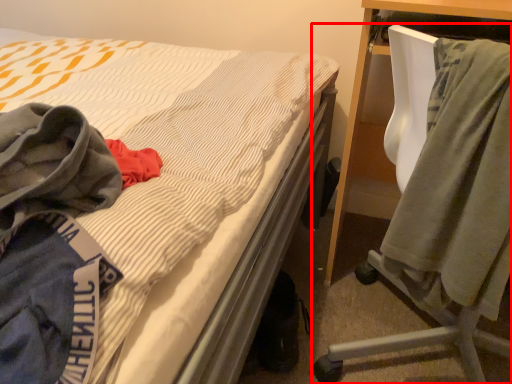
Question: From the image's perspective, where is chair (annotated by the red box) located in relation to cloak in the image?

Choices:
 (A) above
 (B) below

Answer: (A)